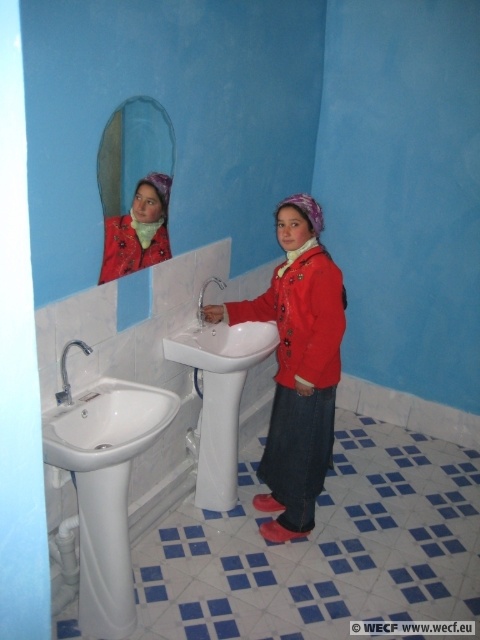
You are a parent supervising a child in the bathroom. The child is wearing a matte red jacket at center and standing near the silver metallic faucet at sink left. Which object is positioned higher relative to the other?

The silver metallic faucet at sink left is positioned higher than the matte red jacket at center.